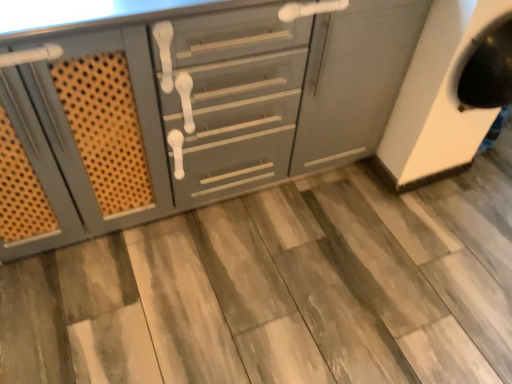
Identify the location of wooden tile at center. This screenshot has height=384, width=512. (278, 291).

The image size is (512, 384). What do you see at coordinates (278, 291) in the screenshot?
I see `wooden tile at center` at bounding box center [278, 291].

Measure the distance between point (67,117) and camera.

Point (67,117) and camera are 1.11 meters apart from each other.

Where is `matte gray cabinet at center`? The image size is (512, 384). matte gray cabinet at center is located at coordinates (212, 107).

What do you see at coordinates (212, 107) in the screenshot?
I see `matte gray cabinet at center` at bounding box center [212, 107].

The width and height of the screenshot is (512, 384). I want to click on wooden tile at center, so click(278, 291).

In the scene shown: Between matte gray cabinet at center and wooden tile at center, which one appears on the left side from the viewer's perspective?

Positioned to the left is matte gray cabinet at center.

Between matte gray cabinet at center and wooden tile at center, which one is positioned behind?

wooden tile at center is further from the camera.

Is point (204, 170) closer to camera compared to point (101, 345)?

No.

From the image's perspective, who appears lower, matte gray cabinet at center or wooden tile at center?

wooden tile at center, from the image's perspective.

From a real-world perspective, is matte gray cabinet at center over wooden tile at center?

Yes, from a real-world perspective, matte gray cabinet at center is above wooden tile at center.

Which object is thinner, matte gray cabinet at center or wooden tile at center?

matte gray cabinet at center is thinner.

Which of these two, matte gray cabinet at center or wooden tile at center, stands taller?

matte gray cabinet at center.

Considering the sizes of objects matte gray cabinet at center and wooden tile at center in the image provided, who is bigger, matte gray cabinet at center or wooden tile at center?

matte gray cabinet at center.

Do you think matte gray cabinet at center is within wooden tile at center, or outside of it?

matte gray cabinet at center is not inside wooden tile at center, it's outside.

Is matte gray cabinet at center not close to wooden tile at center?

matte gray cabinet at center is near wooden tile at center, not far away.

From the picture: Could you tell me if matte gray cabinet at center is facing wooden tile at center?

Yes.

How many degrees apart are the facing directions of matte gray cabinet at center and wooden tile at center?

They differ by 0.338 degrees in their facing directions.

How far apart are matte gray cabinet at center and wooden tile at center?

A distance of 17.59 inches exists between matte gray cabinet at center and wooden tile at center.

Find the location of a particular element. cabinetry that is in front of the wooden tile at center is located at coordinates (212, 107).

In the image, is wooden tile at center on the left side or the right side of matte gray cabinet at center?

wooden tile at center is positioned on matte gray cabinet at center's right side.

Does wooden tile at center come behind matte gray cabinet at center?

Yes, it is.

Which is behind, point (478, 200) or point (285, 72)?

Point (478, 200)

From the image's perspective, is wooden tile at center on matte gray cabinet at center?

No, from the image's perspective, wooden tile at center is not above matte gray cabinet at center.

From a real-world perspective, between wooden tile at center and matte gray cabinet at center, who is vertically lower?

From a 3D spatial view, wooden tile at center is below.

Which of these two, wooden tile at center or matte gray cabinet at center, is wider?

Wider between the two is wooden tile at center.

Does wooden tile at center have a greater height compared to matte gray cabinet at center?

No.

Considering the relative sizes of wooden tile at center and matte gray cabinet at center in the image provided, is wooden tile at center bigger than matte gray cabinet at center?

No, wooden tile at center is not bigger than matte gray cabinet at center.

Would you say wooden tile at center is outside matte gray cabinet at center?

wooden tile at center lies outside matte gray cabinet at center's area.

Is wooden tile at center in contact with matte gray cabinet at center?

wooden tile at center and matte gray cabinet at center are not in contact.

Could you tell me if wooden tile at center is facing matte gray cabinet at center?

No.

What's the angular difference between wooden tile at center and matte gray cabinet at center's facing directions?

The angle between the facing direction of wooden tile at center and the facing direction of matte gray cabinet at center is 0.338 degrees.

Find the location of a particular element. Image resolution: width=512 pixels, height=384 pixels. tile below the matte gray cabinet at center (from the image's perspective) is located at coordinates (278, 291).

Locate an element on the screen. This screenshot has height=384, width=512. tile on the right side of matte gray cabinet at center is located at coordinates (278, 291).

Identify the location of cabinetry above the wooden tile at center (from the image's perspective). Image resolution: width=512 pixels, height=384 pixels. (212, 107).